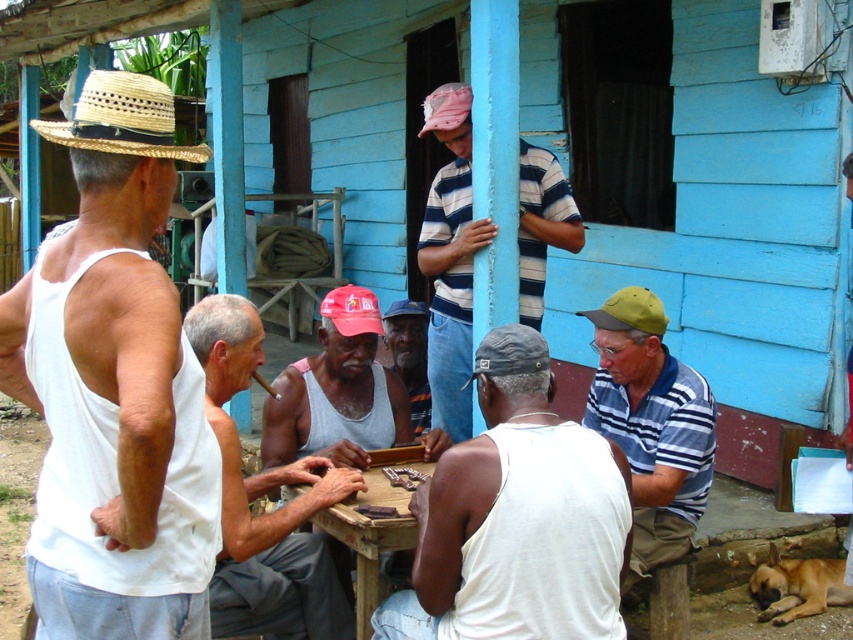
Question: In this image, where is white matte tank top at left located relative to dark brown leather cap at center?

Choices:
 (A) right
 (B) left

Answer: (B)

Question: Among these objects, which one is farthest from the camera?

Choices:
 (A) red fabric cap at center
 (B) striped cotton shirt at lower right
 (C) strawhat at upper left

Answer: (A)

Question: Which of these objects is positioned closest to the white matte tank top at left?

Choices:
 (A) strawmaterial/texturehat at upper left
 (B) striped cotton shirt at center
 (C) matte red cap at center

Answer: (C)

Question: Which point is closer to the camera?

Choices:
 (A) strawmaterial/texturehat at upper left
 (B) white cotton shirt at center

Answer: (B)

Question: Does white matte tank top at center have a smaller size compared to matte red cap at center?

Choices:
 (A) yes
 (B) no

Answer: (B)

Question: Is white tank top at center to the left of green fabric cap at lower right from the viewer's perspective?

Choices:
 (A) no
 (B) yes

Answer: (B)